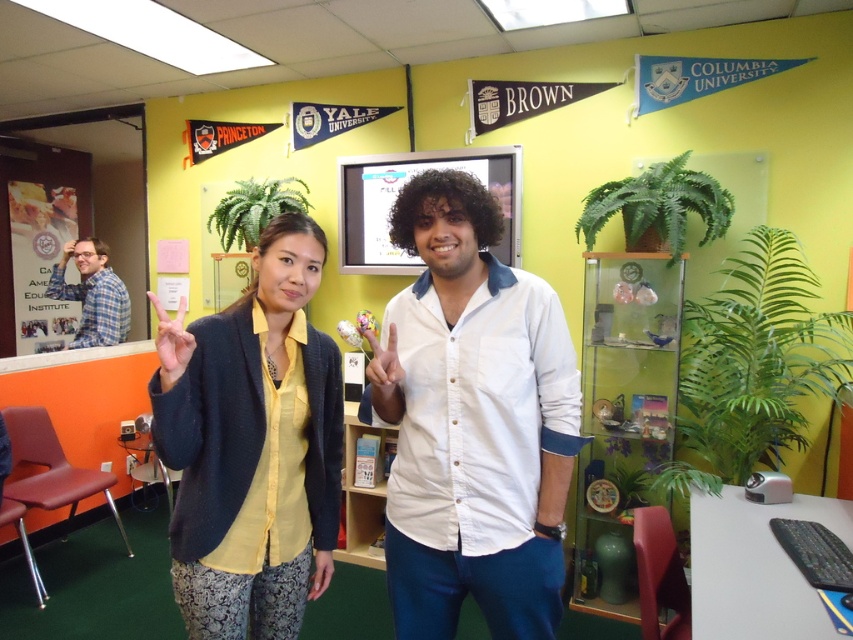
Is matte yellow shirt at center thinner than plaid fabric shirt at left?

Correct, matte yellow shirt at center's width is less than plaid fabric shirt at left's.

Which is more to the left, matte yellow shirt at center or plaid fabric shirt at left?

Positioned to the left is plaid fabric shirt at left.

Does point (310, 502) come in front of point (103, 296)?

Yes, point (310, 502) is closer to viewer.

What are the coordinates of `matte yellow shirt at center` in the screenshot? It's located at (252, 445).

Who is shorter, green leafy plant at right or green leafy plant at upper center?

With less height is green leafy plant at upper center.

Looking at this image, who is more distant from viewer, (780, 410) or (215, 211)?

The point (215, 211) is behind.

This screenshot has width=853, height=640. Identify the location of green leafy plant at right. (753, 364).

Does matte yellow shirt at center have a greater height compared to green leafy plant at right?

No.

Is matte yellow shirt at center shorter than green leafy plant at right?

Indeed, matte yellow shirt at center has a lesser height compared to green leafy plant at right.

Identify the location of matte yellow shirt at center. This screenshot has height=640, width=853. (252, 445).

Identify the location of matte yellow shirt at center. The width and height of the screenshot is (853, 640). (252, 445).